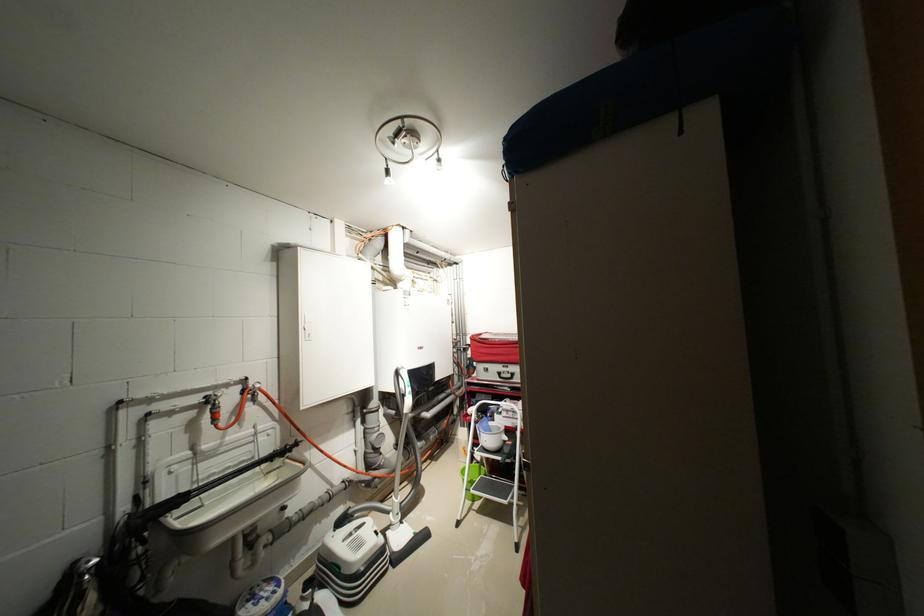
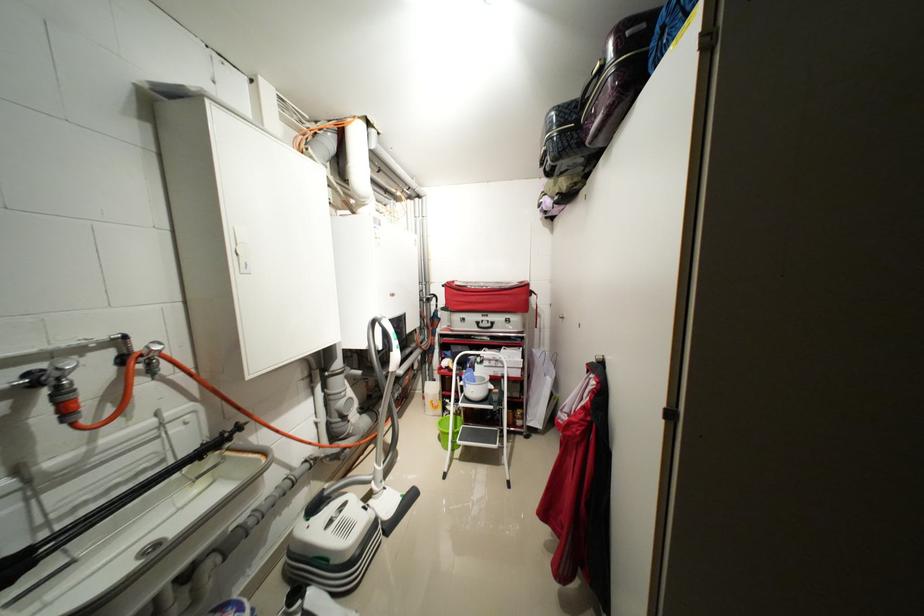
In the second image, find the point that corresponds to the point at 223,411 in the first image.

(71, 399)